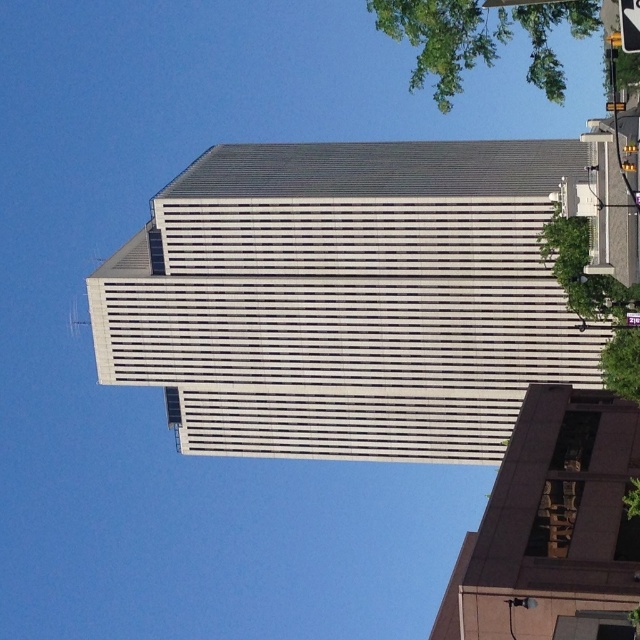
You are standing at the base of the tall modern building and looking upwards. You notice two points marked on the facade. The first point is at coordinates point (547, 90) and the second is at point (612, 380). Which point is closer to you when viewed from your current position?

Point (547, 90) is in front of point (612, 380), so it is closer to you when viewed from your current position at the base of the building.

You are standing on the sidewalk in front of the gray concrete building at center and want to take a photo of it. However, there is a green leafy tree at upper right. Will the tree block your view of the building?

The green leafy tree at upper right is behind the gray concrete building at center, so it will not block your view of the building.

Consider the image. You are standing at the entrance of the tall, modern building and want to take a photo of the brown textured building at lower right. Based on its position, which direction should you face to capture it in the frame?

The brown textured building at lower right is located at point (x=552, y=528), which is towards the lower right side of the image. To capture it in your photo, you should face towards the lower right direction from the entrance of the tall modern building.